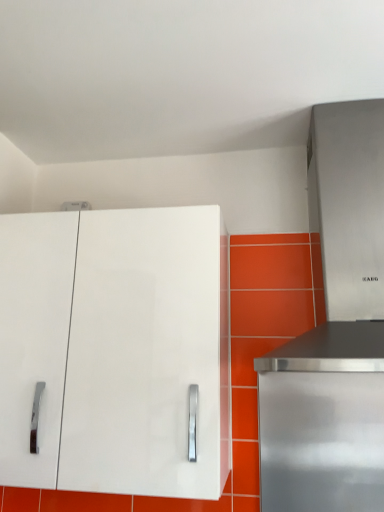
The width and height of the screenshot is (384, 512). Describe the element at coordinates (323, 420) in the screenshot. I see `stainless steel range hood at right` at that location.

What do you see at coordinates (334, 333) in the screenshot? The image size is (384, 512). I see `stainless steel range hood at upper right` at bounding box center [334, 333].

Identify the location of stainless steel range hood at right. This screenshot has height=512, width=384. (323, 420).

Locate an element on the screen. home appliance that is on the right side of white glossy cabinet at upper left is located at coordinates (323, 420).

Are stainless steel range hood at right and white glossy cabinet at upper left making contact?

No, stainless steel range hood at right is not touching white glossy cabinet at upper left.

Considering the relative sizes of stainless steel range hood at right and white glossy cabinet at upper left in the image provided, is stainless steel range hood at right bigger than white glossy cabinet at upper left?

Incorrect, stainless steel range hood at right is not larger than white glossy cabinet at upper left.

Does stainless steel range hood at right come in front of white glossy cabinet at upper left?

No, the depth of stainless steel range hood at right is greater than that of white glossy cabinet at upper left.

Considering the relative sizes of white glossy cabinet at upper left and stainless steel range hood at upper right in the image provided, is white glossy cabinet at upper left smaller than stainless steel range hood at upper right?

Incorrect, white glossy cabinet at upper left is not smaller in size than stainless steel range hood at upper right.

Is point (185, 466) in front of point (306, 398)?

Yes.

Consider the image. Considering the positions of objects white glossy cabinet at upper left and stainless steel range hood at upper right in the image provided, who is more to the right, white glossy cabinet at upper left or stainless steel range hood at upper right?

stainless steel range hood at upper right.

Are white glossy cabinet at upper left and stainless steel range hood at upper right far apart?

white glossy cabinet at upper left is actually quite close to stainless steel range hood at upper right.

Is stainless steel range hood at right spatially inside stainless steel range hood at upper right, or outside of it?

stainless steel range hood at right is not inside stainless steel range hood at upper right, it's outside.

Can you confirm if stainless steel range hood at right is positioned to the right of stainless steel range hood at upper right?

Correct, you'll find stainless steel range hood at right to the right of stainless steel range hood at upper right.

Between stainless steel range hood at right and stainless steel range hood at upper right, which one has larger size?

With larger size is stainless steel range hood at upper right.

Is stainless steel range hood at right beside stainless steel range hood at upper right?

No, stainless steel range hood at right is not touching stainless steel range hood at upper right.

How many degrees apart are the facing directions of stainless steel range hood at upper right and stainless steel range hood at right?

There is a 0.00341-degree angle between the facing directions of stainless steel range hood at upper right and stainless steel range hood at right.

From a real-world perspective, who is located lower, stainless steel range hood at upper right or stainless steel range hood at right?

stainless steel range hood at right is physically lower.

Looking at this image, based on their sizes in the image, would you say stainless steel range hood at upper right is bigger or smaller than stainless steel range hood at right?

Clearly, stainless steel range hood at upper right is larger in size than stainless steel range hood at right.

Is stainless steel range hood at upper right wider or thinner than stainless steel range hood at right?

In the image, stainless steel range hood at upper right appears to be wider than stainless steel range hood at right.

Does stainless steel range hood at upper right have a lesser width compared to white glossy cabinet at upper left?

Incorrect, the width of stainless steel range hood at upper right is not less than that of white glossy cabinet at upper left.

Choose the correct answer: Is stainless steel range hood at upper right inside white glossy cabinet at upper left or outside it?

stainless steel range hood at upper right is outside white glossy cabinet at upper left.

Considering the relative sizes of stainless steel range hood at upper right and white glossy cabinet at upper left in the image provided, is stainless steel range hood at upper right taller than white glossy cabinet at upper left?

Correct, stainless steel range hood at upper right is much taller as white glossy cabinet at upper left.

Considering the points (173, 231) and (294, 489), which point is behind, point (173, 231) or point (294, 489)?

Positioned behind is point (294, 489).

Could you tell me if white glossy cabinet at upper left is facing stainless steel range hood at right?

No, white glossy cabinet at upper left does not turn towards stainless steel range hood at right.

From the picture: From the image's perspective, which is above, white glossy cabinet at upper left or stainless steel range hood at right?

white glossy cabinet at upper left.

Which object is closer to the camera taking this photo, white glossy cabinet at upper left or stainless steel range hood at right?

Positioned in front is white glossy cabinet at upper left.

Locate an element on the screen. The width and height of the screenshot is (384, 512). cabinetry above the stainless steel range hood at right (from a real-world perspective) is located at coordinates (115, 350).

Identify the location of appliance located above the white glossy cabinet at upper left (from the image's perspective). This screenshot has width=384, height=512. (334, 333).

Based on the photo, when comparing their distances from stainless steel range hood at right, does white glossy cabinet at upper left or stainless steel range hood at upper right seem further?

white glossy cabinet at upper left is further to stainless steel range hood at right.

When comparing their distances from white glossy cabinet at upper left, does stainless steel range hood at upper right or stainless steel range hood at right seem further?

Among the two, stainless steel range hood at right is located further to white glossy cabinet at upper left.

Estimate the real-world distances between objects in this image. Which object is closer to stainless steel range hood at right, stainless steel range hood at upper right or white glossy cabinet at upper left?

stainless steel range hood at upper right lies closer to stainless steel range hood at right than the other object.

From the picture: When comparing their distances from white glossy cabinet at upper left, does stainless steel range hood at right or stainless steel range hood at upper right seem further?

stainless steel range hood at right.

Estimate the real-world distances between objects in this image. Which object is further from stainless steel range hood at upper right, white glossy cabinet at upper left or stainless steel range hood at right?

white glossy cabinet at upper left.

Considering their positions, is stainless steel range hood at right positioned closer to stainless steel range hood at upper right than white glossy cabinet at upper left?

The object closer to stainless steel range hood at upper right is stainless steel range hood at right.

Where is `appliance between white glossy cabinet at upper left and stainless steel range hood at right from left to right`? The width and height of the screenshot is (384, 512). appliance between white glossy cabinet at upper left and stainless steel range hood at right from left to right is located at coordinates (334, 333).